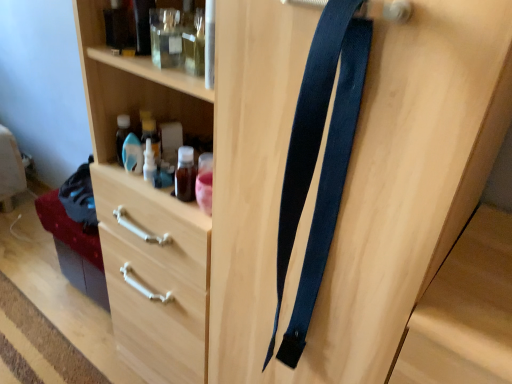
Question: Can you confirm if dark blue fabric suspenders at center is bigger than wooden drawer at lower left?

Choices:
 (A) yes
 (B) no

Answer: (B)

Question: From the image's perspective, is dark blue fabric suspenders at center under wooden drawer at lower left?

Choices:
 (A) no
 (B) yes

Answer: (A)

Question: Is dark blue fabric suspenders at center taller than wooden drawer at lower left?

Choices:
 (A) no
 (B) yes

Answer: (B)

Question: Is dark blue fabric suspenders at center at the left side of wooden drawer at lower left?

Choices:
 (A) no
 (B) yes

Answer: (A)

Question: Can you confirm if dark blue fabric suspenders at center is thinner than wooden drawer at lower left?

Choices:
 (A) no
 (B) yes

Answer: (B)

Question: In terms of width, does wooden drawer at lower left look wider or thinner when compared to dark blue fabric suspenders at center?

Choices:
 (A) thin
 (B) wide

Answer: (B)

Question: From a real-world perspective, is wooden drawer at lower left above or below dark blue fabric suspenders at center?

Choices:
 (A) below
 (B) above

Answer: (A)

Question: From their relative heights in the image, would you say wooden drawer at lower left is taller or shorter than dark blue fabric suspenders at center?

Choices:
 (A) tall
 (B) short

Answer: (B)

Question: Based on their positions, is wooden drawer at lower left located to the left or right of dark blue fabric suspenders at center?

Choices:
 (A) left
 (B) right

Answer: (A)

Question: From the image's perspective, is transparent plastic bottle at upper center positioned above or below dark blue fabric suspenders at center?

Choices:
 (A) above
 (B) below

Answer: (A)

Question: In the image, is transparent plastic bottle at upper center positioned in front of or behind dark blue fabric suspenders at center?

Choices:
 (A) front
 (B) behind

Answer: (B)

Question: Considering the positions of transparent plastic bottle at upper center and dark blue fabric suspenders at center in the image, is transparent plastic bottle at upper center taller or shorter than dark blue fabric suspenders at center?

Choices:
 (A) short
 (B) tall

Answer: (A)

Question: Is point (151, 152) closer or farther from the camera than point (279, 289)?

Choices:
 (A) farther
 (B) closer

Answer: (A)

Question: Considering the positions of point (145, 180) and point (168, 367), is point (145, 180) closer or farther from the camera than point (168, 367)?

Choices:
 (A) closer
 (B) farther

Answer: (A)

Question: From a real-world perspective, is transparent plastic bottle at upper center above or below wooden drawer at lower left?

Choices:
 (A) below
 (B) above

Answer: (B)